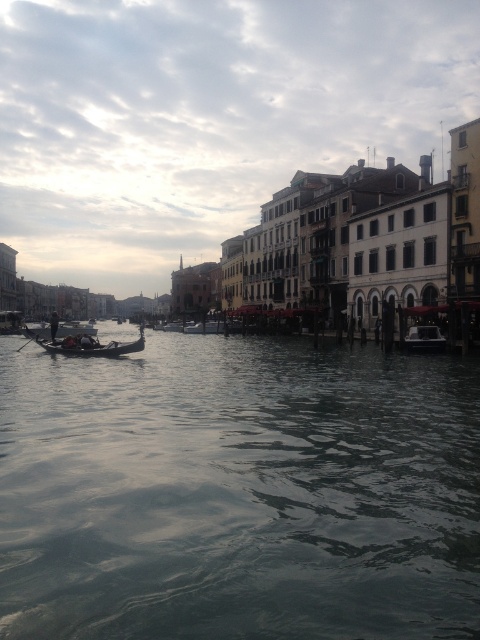
Is wooden gondola at center to the left of black wood paddle at lower left from the viewer's perspective?

Incorrect, wooden gondola at center is not on the left side of black wood paddle at lower left.

Measure the distance between point (140, 337) and camera.

Point (140, 337) and camera are 71.58 meters apart.

Who is more forward, (72,348) or (40,332)?

Point (72,348) is more forward.

Where is `wooden gondola at center`? The image size is (480, 640). wooden gondola at center is located at coordinates (92, 346).

Is dark gray water at center shorter than dark blue fabric person at left?

Indeed, dark gray water at center has a lesser height compared to dark blue fabric person at left.

Between dark gray water at center and dark blue fabric person at left, which one is positioned lower?

dark gray water at center is below.

This screenshot has height=640, width=480. In order to click on dark gray water at center in this screenshot , I will do `click(238, 492)`.

Locate an element on the screen. Image resolution: width=480 pixels, height=640 pixels. dark gray water at center is located at coordinates (x=238, y=492).

Who is taller, wooden gondola at center or dark blue fabric person at left?

With more height is dark blue fabric person at left.

Who is positioned more to the right, wooden gondola at center or dark blue fabric person at left?

Positioned to the right is wooden gondola at center.

Is point (68, 352) less distant than point (52, 333)?

Yes, point (68, 352) is in front of point (52, 333).

Identify the location of wooden gondola at center. Image resolution: width=480 pixels, height=640 pixels. coord(92,346).